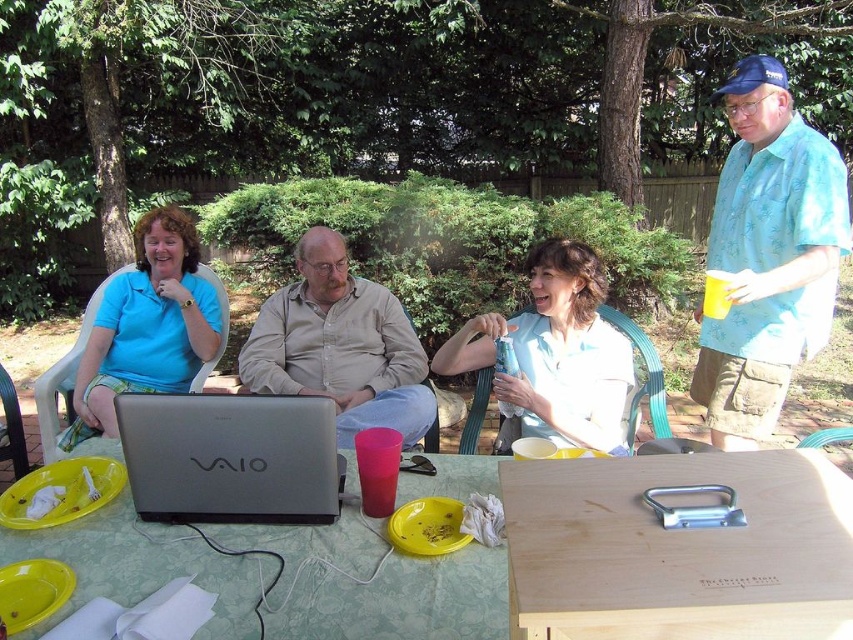
Is blue floral shirt at upper right smaller than silver metallic laptop at center?

Actually, blue floral shirt at upper right might be larger than silver metallic laptop at center.

Does blue floral shirt at upper right appear on the left side of silver metallic laptop at center?

Incorrect, blue floral shirt at upper right is not on the left side of silver metallic laptop at center.

Locate an element on the screen. blue floral shirt at upper right is located at coordinates (769, 253).

Between wooden at center and white matte water bottle at center, which one has more height?

Standing taller between the two is white matte water bottle at center.

Where is `wooden at center`? This screenshot has width=853, height=640. wooden at center is located at coordinates (677, 548).

Who is more distant from viewer, [763,566] or [473,365]?

Point [473,365]

Identify the location of wooden at center. This screenshot has width=853, height=640. (677, 548).

Is wooden at center positioned before silver metallic laptop at center?

Yes, it is.

The width and height of the screenshot is (853, 640). Find the location of `wooden at center`. wooden at center is located at coordinates (677, 548).

Where is `wooden at center`? Image resolution: width=853 pixels, height=640 pixels. wooden at center is located at coordinates pos(677,548).